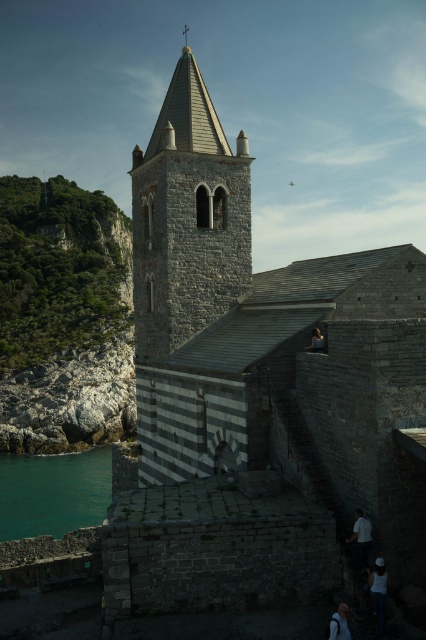
You are standing at the base of the church facing the bell tower. There are two points marked on the image. One is at coordinate point (195, 509) and the other at point (69, 467). Which point is nearer to you?

Point (195, 509) is closer to the viewer than point (69, 467).

You are a photographer capturing a scene of a historic stone church by the sea. In the foreground, you notice a white fabric shirt at lower right and smooth gray hair at center. Which object would appear larger in your photo?

The white fabric shirt at lower right is bigger than the smooth gray hair at center, so it would appear larger in the photo.

You are standing in front of the historic stone church by the sea. You notice a point marked at coordinates (360, 538). Based on the scene, where is this point located?

The point at (360, 538) is on the white fabric shirt at lower right.